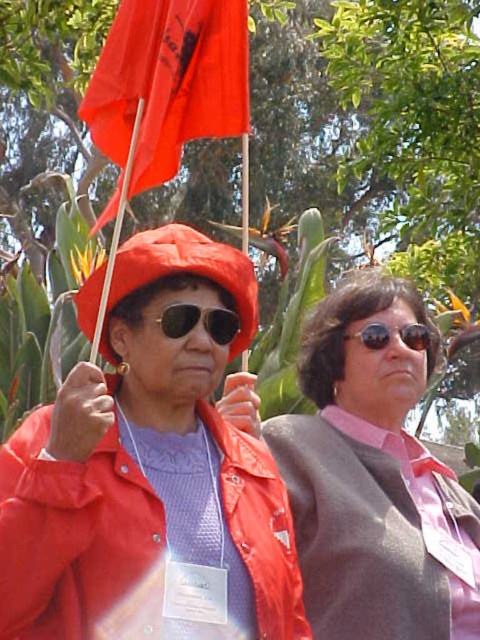
In the scene shown: Does matte orange flag at upper left have a larger size compared to matte black goggles at center?

Indeed, matte orange flag at upper left has a larger size compared to matte black goggles at center.

Between point (158, 150) and point (196, 312), which one is positioned in front?

Positioned in front is point (196, 312).

You are a GUI agent. You are given a task and a screenshot of the screen. Output one action in this format:
    pyautogui.click(x=<x>, y=<y>)
    Task: Click on the matte orange flag at upper left
    This screenshot has height=640, width=480.
    Given the screenshot: What is the action you would take?
    pyautogui.click(x=167, y=86)

Can you confirm if matte black goggles at center is taller than black reflective sunglasses at center?

Indeed, matte black goggles at center has a greater height compared to black reflective sunglasses at center.

Is point (213, 333) behind point (420, 344)?

No.

Is point (177, 337) positioned behind point (362, 340)?

No, (177, 337) is in front of (362, 340).

Where is `matte black goggles at center`? matte black goggles at center is located at coordinates (199, 321).

From the picture: Is the position of matte red hat at upper left less distant than that of matte black goggles at center?

That is True.

Is matte red hat at upper left positioned behind matte black goggles at center?

No.

Does point (169, 513) come behind point (182, 314)?

No, (169, 513) is closer to viewer.

Image resolution: width=480 pixels, height=640 pixels. I want to click on matte red hat at upper left, so click(149, 476).